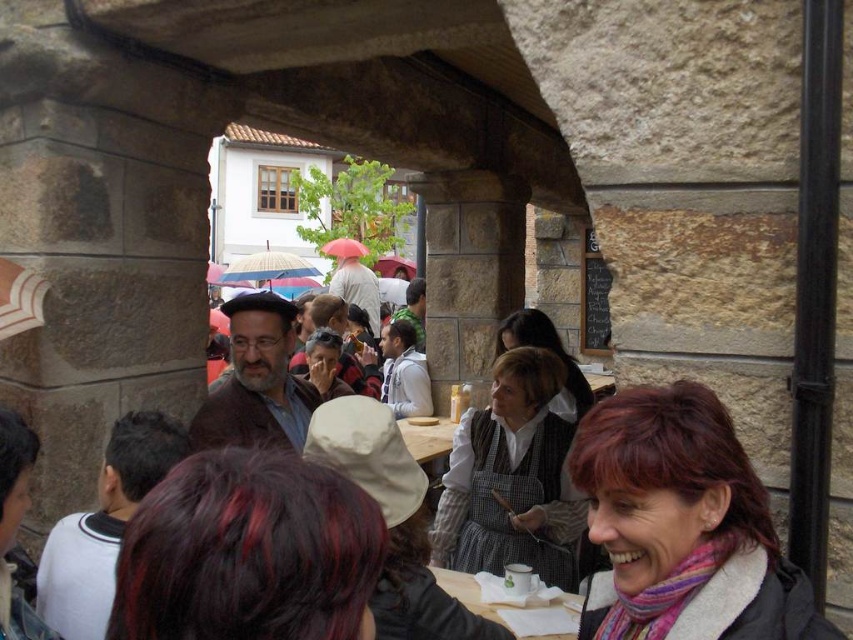
Which is in front, point (258, 541) or point (544, 342)?

Positioned in front is point (258, 541).

The height and width of the screenshot is (640, 853). I want to click on dark red hair at center, so click(248, 552).

Describe the element at coordinates (248, 552) in the screenshot. I see `dark red hair at center` at that location.

You are a GUI agent. You are given a task and a screenshot of the screen. Output one action in this format:
    pyautogui.click(x=<x>, y=<y>)
    Task: Click on the dark red hair at center
    This screenshot has width=853, height=640.
    Given the screenshot: What is the action you would take?
    pyautogui.click(x=248, y=552)

Which is more to the left, dark red hair at center or white cotton apron at center?

From the viewer's perspective, dark red hair at center appears more on the left side.

What do you see at coordinates (248, 552) in the screenshot?
I see `dark red hair at center` at bounding box center [248, 552].

The image size is (853, 640). What do you see at coordinates (248, 552) in the screenshot? I see `dark red hair at center` at bounding box center [248, 552].

The height and width of the screenshot is (640, 853). In order to click on dark red hair at center in this screenshot , I will do `click(248, 552)`.

Can you confirm if multicolored scarf at lower right is shorter than white cotton apron at center?

Correct, multicolored scarf at lower right is not as tall as white cotton apron at center.

Is multicolored scarf at lower right above white cotton apron at center?

Yes.

You are a GUI agent. You are given a task and a screenshot of the screen. Output one action in this format:
    pyautogui.click(x=<x>, y=<y>)
    Task: Click on the multicolored scarf at lower right
    The height and width of the screenshot is (640, 853).
    Given the screenshot: What is the action you would take?
    pyautogui.click(x=688, y=509)